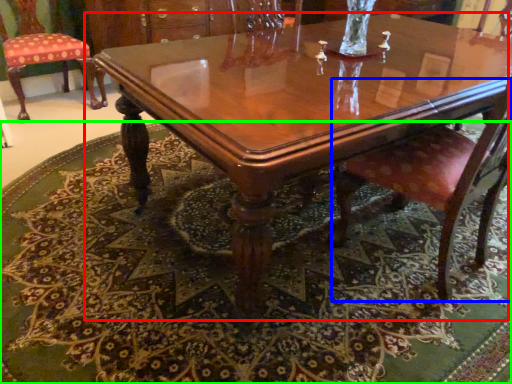
Question: Which object is the closest to the coffee table (highlighted by a red box)? Choose among these: chair (highlighted by a blue box) or mat (highlighted by a green box).

Choices:
 (A) chair
 (B) mat

Answer: (A)